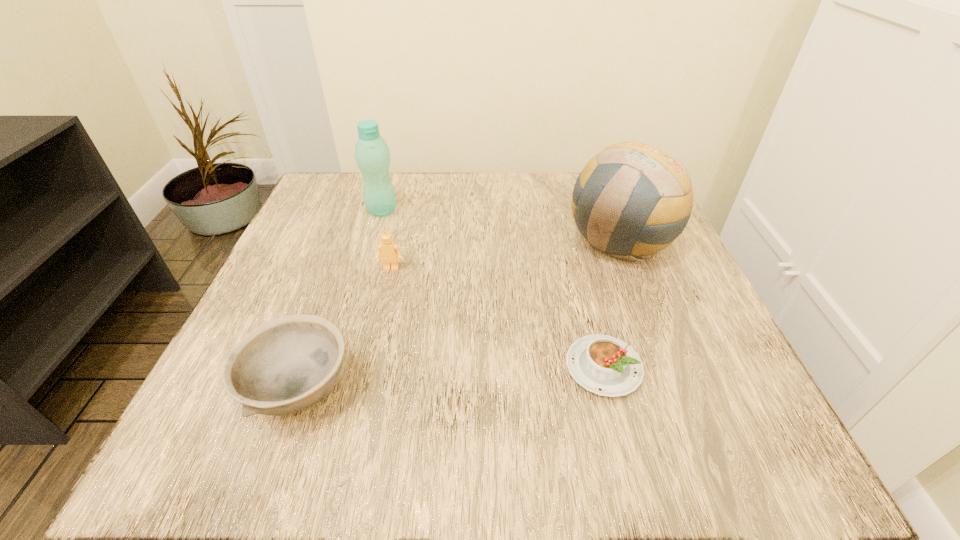
The height and width of the screenshot is (540, 960). Identify the location of volleyball that is at the far edge. (632, 200).

This screenshot has height=540, width=960. Find the location of `bottle located at the far edge`. bottle located at the far edge is located at coordinates (372, 154).

Find the location of a particular element. object situated at the near edge is located at coordinates (285, 365).

Identify the location of bottle located in the left edge section of the desktop. (372, 154).

At what (x,y) coordinates should I click in order to perform the action: click on bowl present at the left edge. Please return your answer as a coordinate pair (x, y). Looking at the image, I should click on (285, 365).

The image size is (960, 540). What are the coordinates of `volleyball present at the right edge` in the screenshot? It's located at (632, 200).

You are a GUI agent. You are given a task and a screenshot of the screen. Output one action in this format:
    pyautogui.click(x=<x>, y=<y>)
    Task: Click on the pudding that is at the right edge
    
    Given the screenshot: What is the action you would take?
    pyautogui.click(x=607, y=366)

You are a GUI agent. You are given a task and a screenshot of the screen. Output one action in this format:
    pyautogui.click(x=<x>, y=<y>)
    Task: Click on the object situated at the far left corner
    
    Given the screenshot: What is the action you would take?
    pyautogui.click(x=372, y=154)

You are a GUI agent. You are given a task and a screenshot of the screen. Output one action in this format:
    pyautogui.click(x=<x>, y=<y>)
    Task: Click on the object that is at the near left corner
    The height and width of the screenshot is (540, 960).
    Given the screenshot: What is the action you would take?
    pyautogui.click(x=285, y=365)

You are a GUI agent. You are given a task and a screenshot of the screen. Output one action in this format:
    pyautogui.click(x=<x>, y=<y>)
    Task: Click on the object that is positioned at the far right corner
    This screenshot has height=540, width=960.
    Given the screenshot: What is the action you would take?
    pyautogui.click(x=632, y=200)